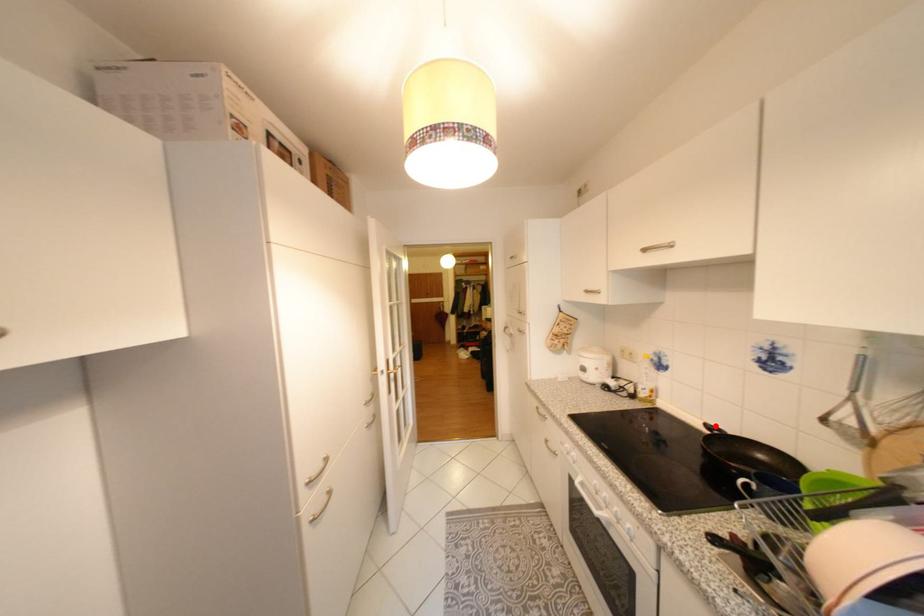
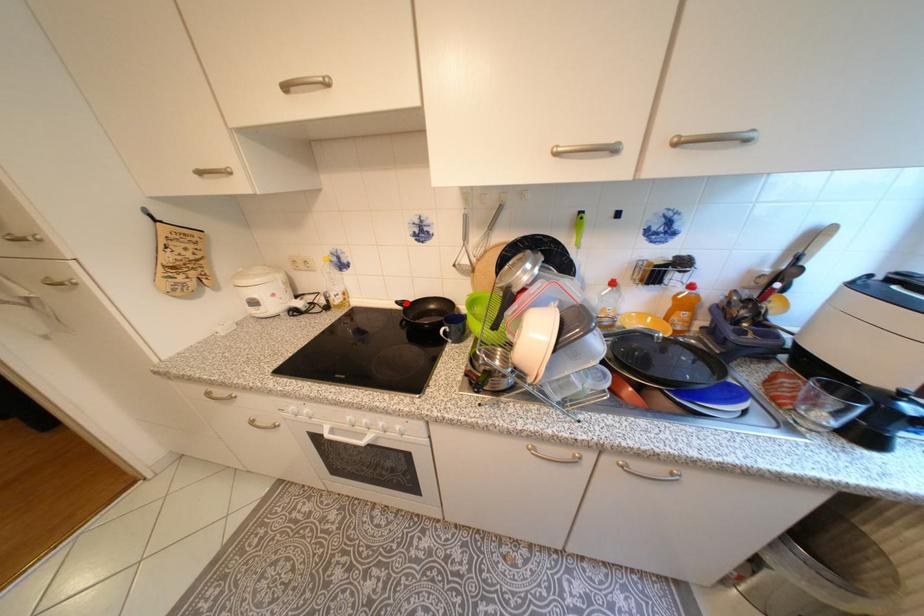
I am providing you with two images of the same scene from different viewpoints. A red point is marked on the first image and another point is marked on the second image. Is the red point in image1 aligned with the point shown in image2?

Yes